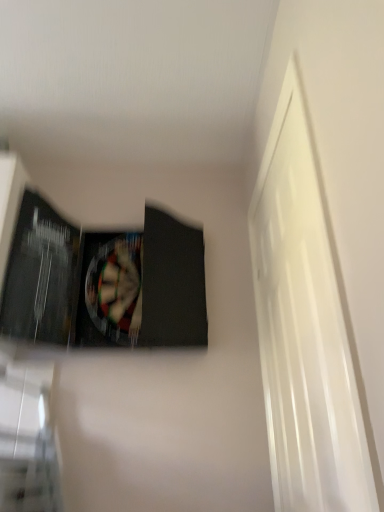
This screenshot has width=384, height=512. What do you see at coordinates (307, 328) in the screenshot? I see `white glossy door at right` at bounding box center [307, 328].

Measure the distance between point [318,509] and camera.

The depth of point [318,509] is 1.03 meters.

Locate an element on the screen. white glossy door at right is located at coordinates (307, 328).

The height and width of the screenshot is (512, 384). What do you see at coordinates (103, 282) in the screenshot? I see `matte black paperback book at upper left` at bounding box center [103, 282].

This screenshot has width=384, height=512. Identify the location of matte black paperback book at upper left. (103, 282).

The width and height of the screenshot is (384, 512). I want to click on white glossy door at right, so click(307, 328).

Considering the relative positions of matte black paperback book at upper left and white glossy door at right in the image provided, is matte black paperback book at upper left to the left of white glossy door at right from the viewer's perspective?

Yes.

Who is more distant, matte black paperback book at upper left or white glossy door at right?

matte black paperback book at upper left is behind.

Is point (196, 250) closer or farther from the camera than point (356, 445)?

Point (196, 250).

From the image's perspective, which one is positioned higher, matte black paperback book at upper left or white glossy door at right?

From the image's view, matte black paperback book at upper left is above.

From a real-world perspective, is matte black paperback book at upper left positioned over white glossy door at right based on gravity?

Indeed, from a real-world perspective, matte black paperback book at upper left stands above white glossy door at right.

In terms of width, does matte black paperback book at upper left look wider or thinner when compared to white glossy door at right?

Clearly, matte black paperback book at upper left has more width compared to white glossy door at right.

Considering the sizes of objects matte black paperback book at upper left and white glossy door at right in the image provided, who is taller, matte black paperback book at upper left or white glossy door at right?

With more height is white glossy door at right.

Based on the photo, does matte black paperback book at upper left have a larger size compared to white glossy door at right?

Yes, matte black paperback book at upper left is bigger than white glossy door at right.

Based on the photo, would you say matte black paperback book at upper left is outside white glossy door at right?

Yes, matte black paperback book at upper left is located beyond the bounds of white glossy door at right.

Is matte black paperback book at upper left next to white glossy door at right?

No.

Is matte black paperback book at upper left facing towards white glossy door at right?

No.

How many degrees apart are the facing directions of matte black paperback book at upper left and white glossy door at right?

They differ by 88.7 degrees in their facing directions.

How much distance is there between matte black paperback book at upper left and white glossy door at right?

matte black paperback book at upper left and white glossy door at right are 22.90 inches apart from each other.

The width and height of the screenshot is (384, 512). There is a white glossy door at right. Find the location of `paperback book above it (from a real-world perspective)`. paperback book above it (from a real-world perspective) is located at coordinates (103, 282).

Considering the positions of objects white glossy door at right and matte black paperback book at upper left in the image provided, who is more to the right, white glossy door at right or matte black paperback book at upper left?

Positioned to the right is white glossy door at right.

Which object is further away from the camera, white glossy door at right or matte black paperback book at upper left?

matte black paperback book at upper left.

Is point (311, 400) positioned in front of point (32, 325)?

Yes, point (311, 400) is closer to viewer.

From the image's perspective, which is below, white glossy door at right or matte black paperback book at upper left?

white glossy door at right, from the image's perspective.

From a real-world perspective, which object rests below the other?

white glossy door at right is physically lower.

Between white glossy door at right and matte black paperback book at upper left, which one has larger width?

With larger width is matte black paperback book at upper left.

Considering the sizes of white glossy door at right and matte black paperback book at upper left in the image, is white glossy door at right taller or shorter than matte black paperback book at upper left?

white glossy door at right is taller than matte black paperback book at upper left.

Between white glossy door at right and matte black paperback book at upper left, which one has smaller size?

With smaller size is white glossy door at right.

Choose the correct answer: Is white glossy door at right inside matte black paperback book at upper left or outside it?

white glossy door at right is not inside matte black paperback book at upper left, it's outside.

Are white glossy door at right and matte black paperback book at upper left located far from each other?

No.

Is white glossy door at right oriented away from matte black paperback book at upper left?

No, matte black paperback book at upper left is not at the back of white glossy door at right.

How different are the orientations of white glossy door at right and matte black paperback book at upper left in degrees?

88.7 degrees.

At what (x,y) coordinates should I click in order to perform the action: click on window located underneath the matte black paperback book at upper left (from a real-world perspective). Please return your answer as a coordinate pair (x, y). Looking at the image, I should click on (307, 328).

Where is `window below the matte black paperback book at upper left (from a real-world perspective)`? The height and width of the screenshot is (512, 384). window below the matte black paperback book at upper left (from a real-world perspective) is located at coordinates (307, 328).

Find the location of `paperback book above the white glossy door at right (from the image's perspective)`. paperback book above the white glossy door at right (from the image's perspective) is located at coordinates (103, 282).